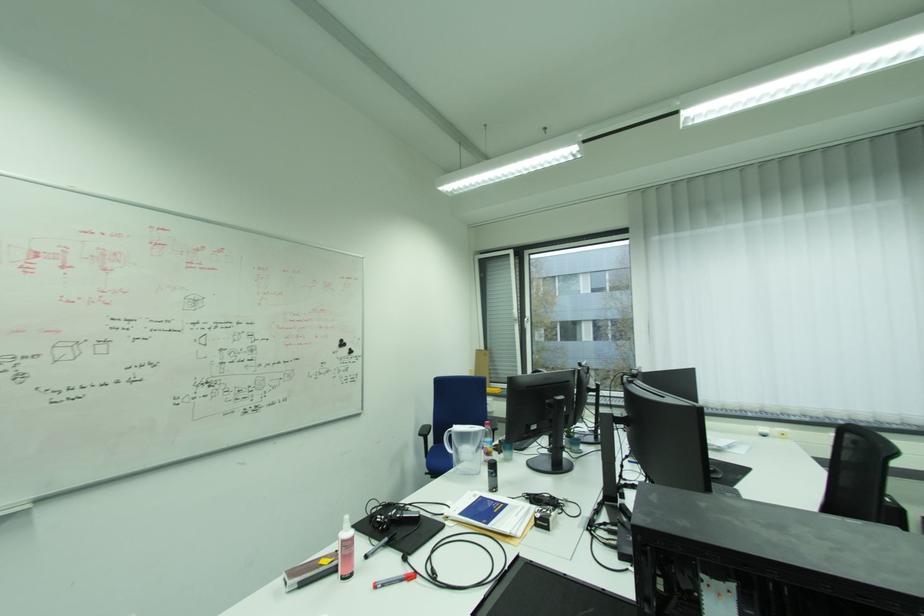
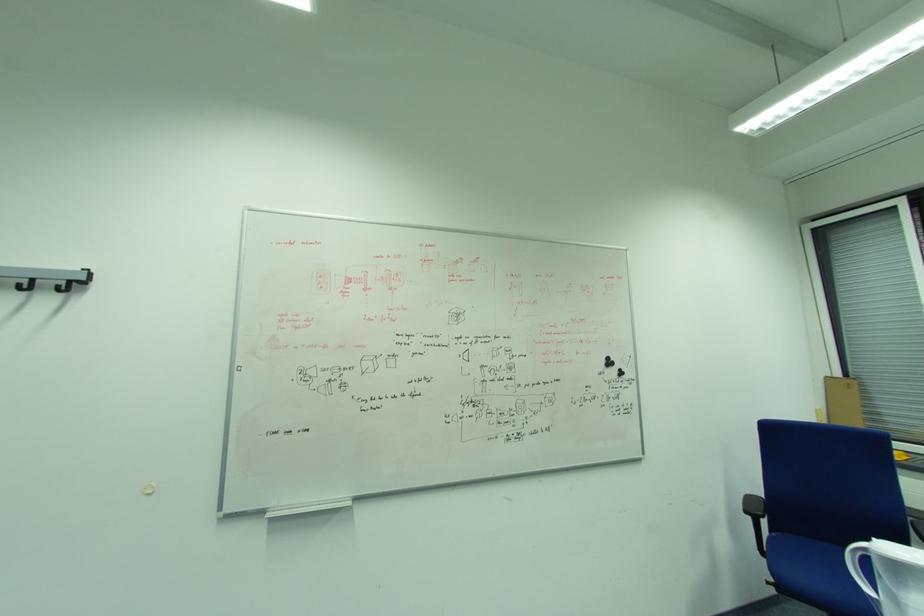
Where in the second image is the point corresponding to the point at 430,438 from the first image?

(757, 517)